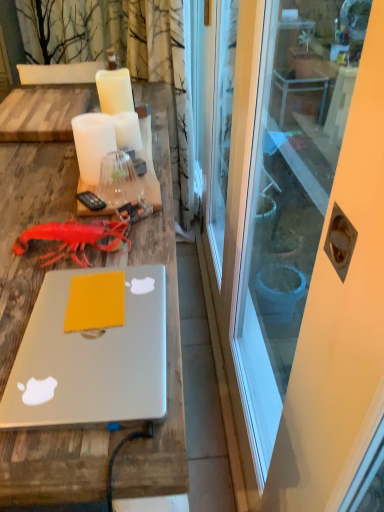
Question: Is white matte candle at center, acting as the first candle starting from the back, to the left of white matte candle at upper center, the 1th candle when ordered from front to back, from the viewer's perspective?

Choices:
 (A) no
 (B) yes

Answer: (A)

Question: Is white matte candle at center, marked as the third candle in a front-to-back arrangement, shorter than white matte candle at upper center, the 1th candle when ordered from front to back?

Choices:
 (A) no
 (B) yes

Answer: (B)

Question: Can you confirm if white matte candle at center, acting as the first candle starting from the back, is bigger than white matte candle at upper center, placed as the third candle when sorted from back to front?

Choices:
 (A) yes
 (B) no

Answer: (B)

Question: Considering the relative sizes of white matte candle at center, marked as the third candle in a front-to-back arrangement, and white matte candle at upper center, placed as the third candle when sorted from back to front, in the image provided, is white matte candle at center, marked as the third candle in a front-to-back arrangement, taller than white matte candle at upper center, placed as the third candle when sorted from back to front,?

Choices:
 (A) yes
 (B) no

Answer: (B)

Question: Is white matte candle at center, marked as the third candle in a front-to-back arrangement, far from white matte candle at upper center, placed as the third candle when sorted from back to front?

Choices:
 (A) no
 (B) yes

Answer: (A)

Question: From the image's perspective, is white matte candle at center, acting as the first candle starting from the back, located above or below white glossy screen door at center?

Choices:
 (A) above
 (B) below

Answer: (A)

Question: Based on their positions, is white matte candle at center, acting as the first candle starting from the back, located to the left or right of white glossy screen door at center?

Choices:
 (A) left
 (B) right

Answer: (A)

Question: Is white matte candle at center, acting as the first candle starting from the back, taller or shorter than white glossy screen door at center?

Choices:
 (A) short
 (B) tall

Answer: (A)

Question: Considering the positions of white matte candle at center, marked as the third candle in a front-to-back arrangement, and white glossy screen door at center in the image, is white matte candle at center, marked as the third candle in a front-to-back arrangement, bigger or smaller than white glossy screen door at center?

Choices:
 (A) big
 (B) small

Answer: (B)

Question: From the image's perspective, is yellow matte notepad at center positioned above or below rubber matte lobster at center?

Choices:
 (A) above
 (B) below

Answer: (B)

Question: Considering the positions of yellow matte notepad at center and rubber matte lobster at center in the image, is yellow matte notepad at center taller or shorter than rubber matte lobster at center?

Choices:
 (A) short
 (B) tall

Answer: (A)

Question: Considering the positions of yellow matte notepad at center and rubber matte lobster at center in the image, is yellow matte notepad at center bigger or smaller than rubber matte lobster at center?

Choices:
 (A) small
 (B) big

Answer: (A)

Question: From a real-world perspective, is yellow matte notepad at center positioned above or below rubber matte lobster at center?

Choices:
 (A) below
 (B) above

Answer: (A)

Question: Considering their positions, is yellow matte notepad at center located in front of or behind white matte candle at center, which appears as the 2th candle when viewed from the front?

Choices:
 (A) front
 (B) behind

Answer: (A)

Question: From a real-world perspective, is yellow matte notepad at center physically located above or below white matte candle at center, which appears as the 2th candle when viewed from the front?

Choices:
 (A) below
 (B) above

Answer: (A)